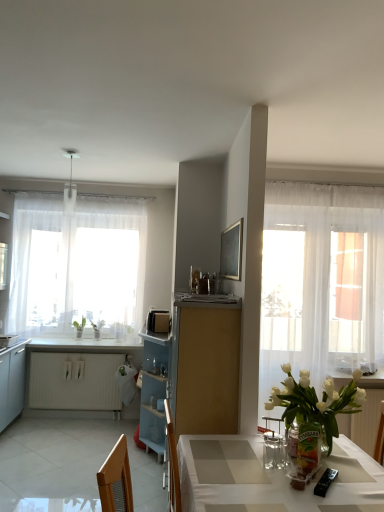
Question: Considering the relative sizes of white glossy microwave at left, placed as the 2th appliance when sorted from top to bottom, and white sheer curtain at left in the image provided, is white glossy microwave at left, placed as the 2th appliance when sorted from top to bottom, thinner than white sheer curtain at left?

Choices:
 (A) no
 (B) yes

Answer: (A)

Question: Can you confirm if white glossy microwave at left, which is the third appliance from right to left, is positioned to the right of white sheer curtain at left?

Choices:
 (A) yes
 (B) no

Answer: (B)

Question: Does white glossy microwave at left, the second appliance positioned from the front, have a greater width compared to white sheer curtain at left?

Choices:
 (A) yes
 (B) no

Answer: (A)

Question: Does white glossy microwave at left, marked as the 2th appliance in a bottom-to-top arrangement, have a larger size compared to white sheer curtain at left?

Choices:
 (A) no
 (B) yes

Answer: (A)

Question: Is white sheer curtain at left inside white glossy microwave at left, marked as the 2th appliance in a bottom-to-top arrangement?

Choices:
 (A) no
 (B) yes

Answer: (A)

Question: Considering the positions of light blue plastic cabinet at center, the second cabinetry when ordered from front to back, and matte wood cabinet at center, acting as the third cabinetry starting from the back, in the image, is light blue plastic cabinet at center, the second cabinetry when ordered from front to back, wider or thinner than matte wood cabinet at center, acting as the third cabinetry starting from the back,?

Choices:
 (A) wide
 (B) thin

Answer: (B)

Question: Looking at the image, does light blue plastic cabinet at center, acting as the 2th cabinetry starting from the right, seem bigger or smaller compared to matte wood cabinet at center, acting as the third cabinetry starting from the back?

Choices:
 (A) big
 (B) small

Answer: (B)

Question: From a real-world perspective, is light blue plastic cabinet at center, the second cabinetry when ordered from front to back, above or below matte wood cabinet at center, placed as the third cabinetry when sorted from left to right?

Choices:
 (A) above
 (B) below

Answer: (B)

Question: Would you say light blue plastic cabinet at center, the second cabinetry when ordered from front to back, is inside or outside matte wood cabinet at center, placed as the third cabinetry when sorted from left to right?

Choices:
 (A) inside
 (B) outside

Answer: (B)

Question: Is white matte radiator at lower left, positioned as the third cabinetry in front-to-back order, to the left or to the right of satin black microwave at center, which is the 3th appliance from front to back, in the image?

Choices:
 (A) right
 (B) left

Answer: (B)

Question: Considering the positions of point (99, 397) and point (147, 329), is point (99, 397) closer or farther from the camera than point (147, 329)?

Choices:
 (A) farther
 (B) closer

Answer: (A)

Question: From the image's perspective, is white matte radiator at lower left, the first cabinetry in the left-to-right sequence, above or below satin black microwave at center, which is the 3th appliance from front to back?

Choices:
 (A) below
 (B) above

Answer: (A)

Question: Considering the positions of white matte radiator at lower left, the 1th cabinetry when ordered from back to front, and satin black microwave at center, which is counted as the first appliance, starting from the top, in the image, is white matte radiator at lower left, the 1th cabinetry when ordered from back to front, bigger or smaller than satin black microwave at center, which is counted as the first appliance, starting from the top,?

Choices:
 (A) big
 (B) small

Answer: (A)

Question: From their relative heights in the image, would you say white glossy microwave at left, which is the third appliance from right to left, is taller or shorter than transparent glass vase at center-right?

Choices:
 (A) short
 (B) tall

Answer: (A)

Question: Considering the positions of white glossy microwave at left, which is the third appliance from right to left, and transparent glass vase at center-right in the image, is white glossy microwave at left, which is the third appliance from right to left, wider or thinner than transparent glass vase at center-right?

Choices:
 (A) thin
 (B) wide

Answer: (B)